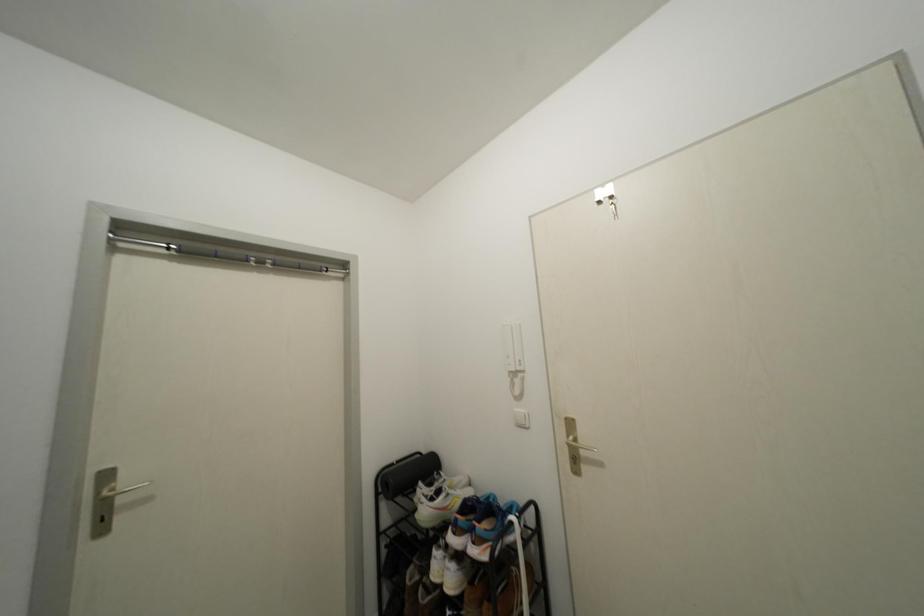
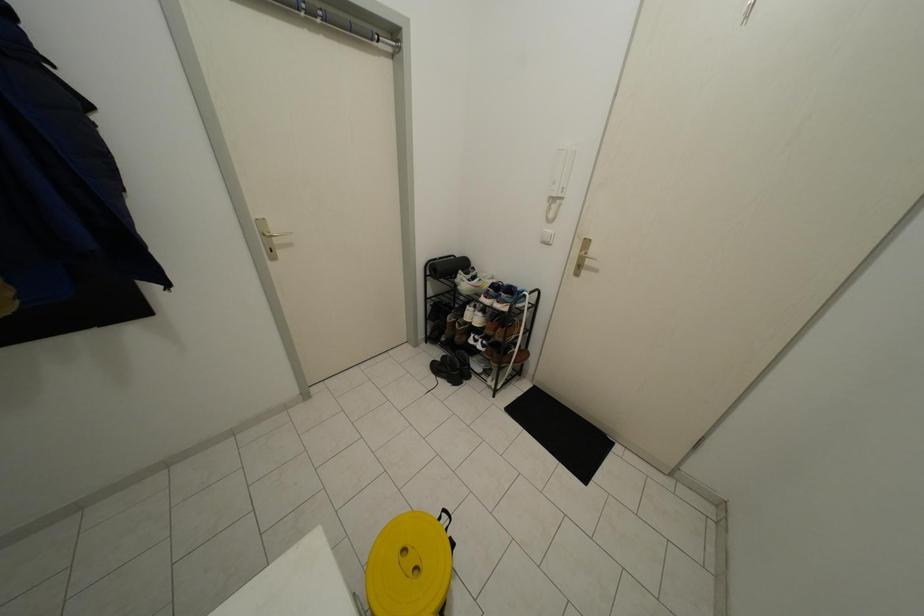
Question: Based on the continuous images, in which direction is the camera rotating? Reply with the corresponding letter.

Choices:
 (A) Left
 (B) Right
 (C) Up
 (D) Down

Answer: (D)